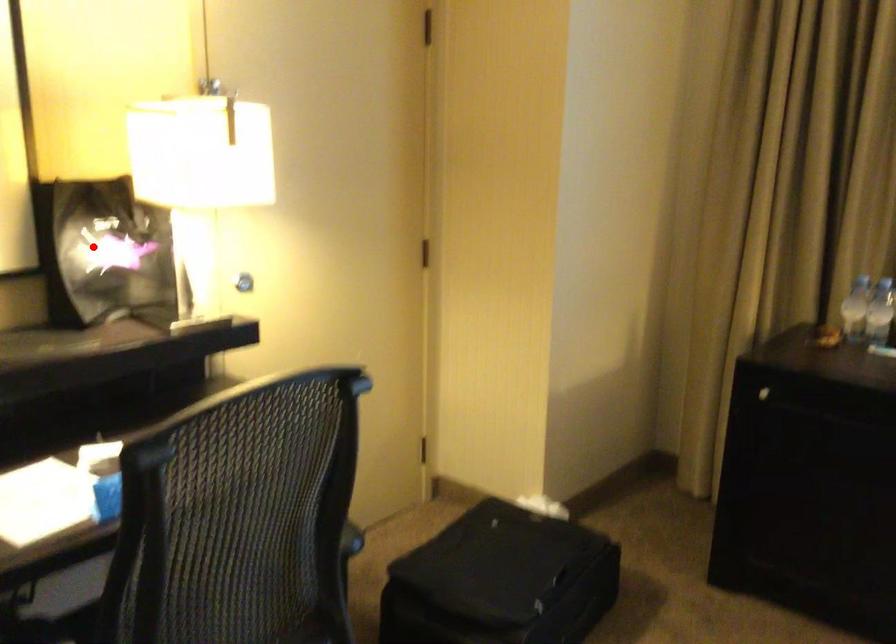
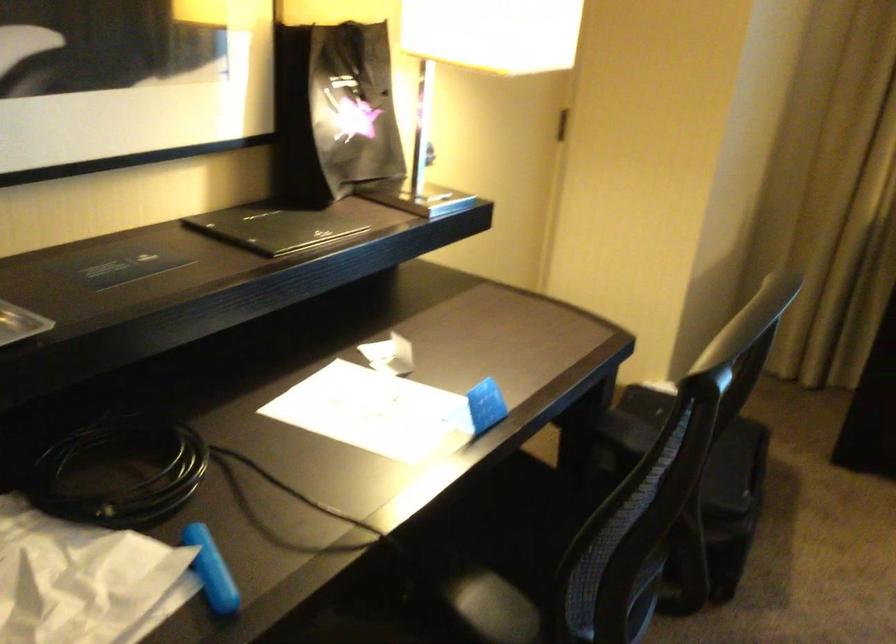
Find the pixel in the second image that matches the highlighted location in the first image.

(334, 111)